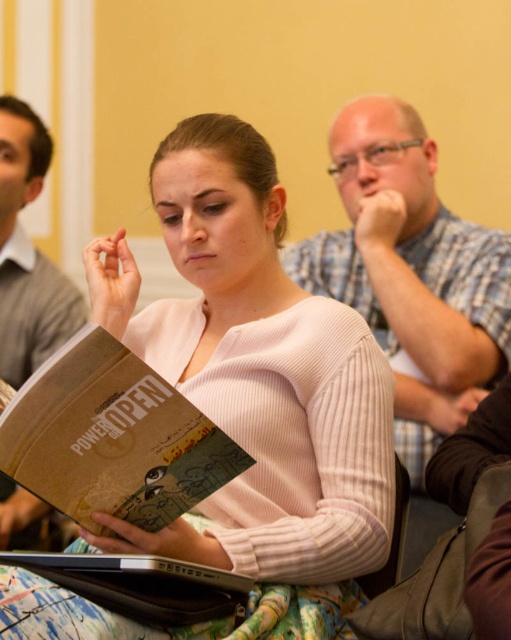
You are standing at the point where the viewer is located in the image. There is a point at coordinates [5,321]. If you want to move closer to that point, which direction should you move?

Since the point at coordinates [5,321] and the viewer are 7.05 feet apart, moving towards the point would require moving forward towards it. The exact direction isn,t specified, but moving closer would involve reducing the distance between them.

You are an observer looking at the scene described. Which of the two sweaters, the pink ribbed sweater at center or the matte gray sweater at center, is positioned lower in the image?

The pink ribbed sweater at center is located below the matte gray sweater at center, so it is positioned lower in the image.